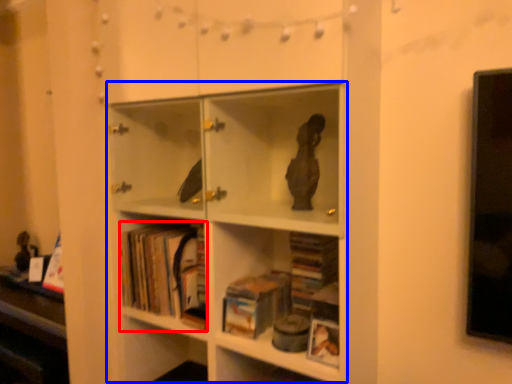
Question: Which object appears closest to the camera in this image, book (highlighted by a red box) or bookcase (highlighted by a blue box)?

Choices:
 (A) book
 (B) bookcase

Answer: (B)